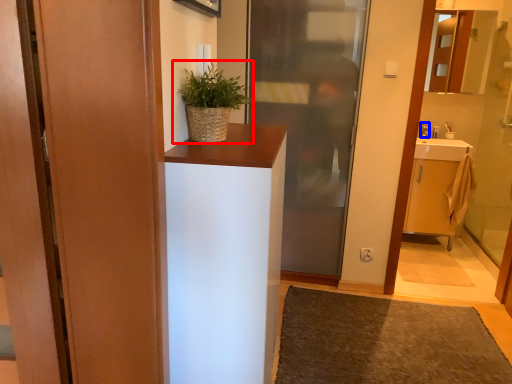
Question: Which object appears closest to the camera in this image, houseplant (highlighted by a red box) or toiletry (highlighted by a blue box)?

Choices:
 (A) houseplant
 (B) toiletry

Answer: (A)